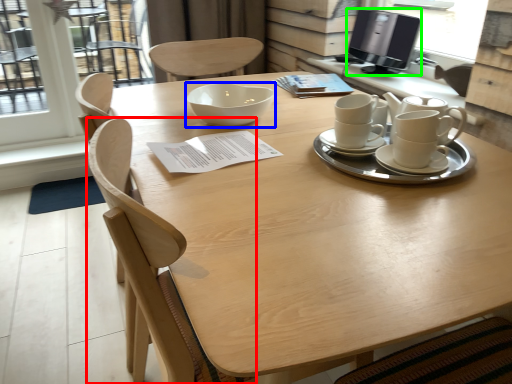
Question: Estimate the real-world distances between objects in this image. Which object is closer to chair (highlighted by a red box), bowl (highlighted by a blue box) or computer monitor (highlighted by a green box)?

Choices:
 (A) bowl
 (B) computer monitor

Answer: (A)